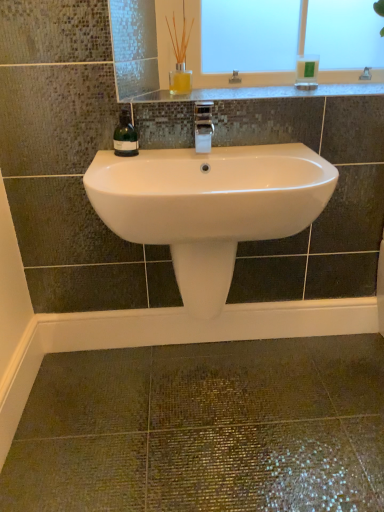
Question: Is green glass bottle at left at the back of white ceramic faucet at center?

Choices:
 (A) no
 (B) yes

Answer: (A)

Question: Is green glass bottle at left located within white ceramic faucet at center?

Choices:
 (A) yes
 (B) no

Answer: (B)

Question: Does white ceramic faucet at center have a greater width compared to green glass bottle at left?

Choices:
 (A) no
 (B) yes

Answer: (B)

Question: Does white ceramic faucet at center come in front of green glass bottle at left?

Choices:
 (A) no
 (B) yes

Answer: (B)

Question: Is white ceramic faucet at center aimed at green glass bottle at left?

Choices:
 (A) no
 (B) yes

Answer: (A)

Question: From the image's perspective, is white ceramic faucet at center below green glass bottle at left?

Choices:
 (A) yes
 (B) no

Answer: (B)

Question: From the image's perspective, is green plastic soap dispenser at upper right under green glass bottle at left?

Choices:
 (A) yes
 (B) no

Answer: (B)

Question: From a real-world perspective, is green plastic soap dispenser at upper right located higher than green glass bottle at left?

Choices:
 (A) no
 (B) yes

Answer: (B)

Question: Can you confirm if green plastic soap dispenser at upper right is bigger than green glass bottle at left?

Choices:
 (A) no
 (B) yes

Answer: (A)

Question: Are green plastic soap dispenser at upper right and green glass bottle at left beside each other?

Choices:
 (A) yes
 (B) no

Answer: (B)

Question: Considering the relative positions of green plastic soap dispenser at upper right and green glass bottle at left in the image provided, is green plastic soap dispenser at upper right to the right of green glass bottle at left from the viewer's perspective?

Choices:
 (A) no
 (B) yes

Answer: (B)

Question: Is green plastic soap dispenser at upper right thinner than green glass bottle at left?

Choices:
 (A) no
 (B) yes

Answer: (A)

Question: Is the surface of green plastic soap dispenser at upper right in direct contact with white glossy sink at center?

Choices:
 (A) no
 (B) yes

Answer: (A)